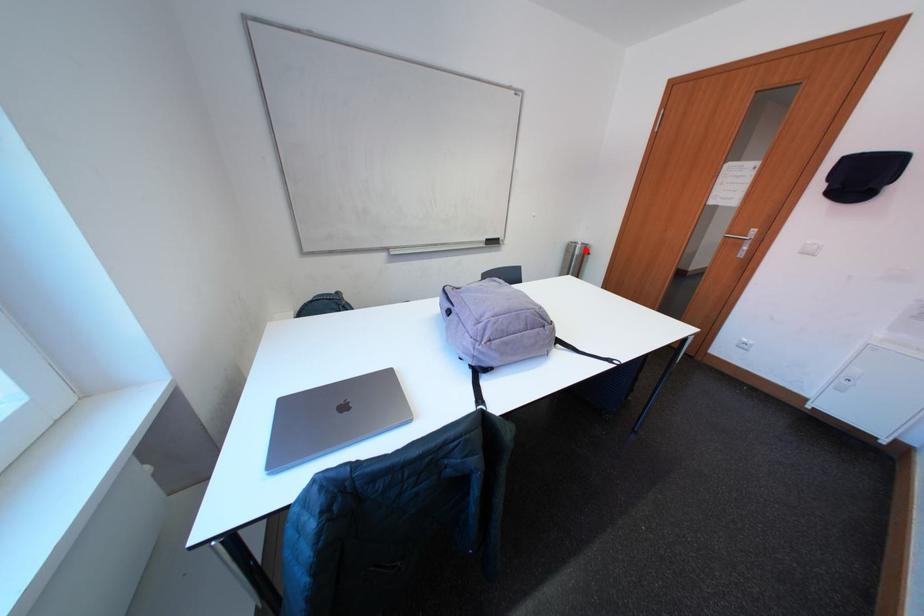
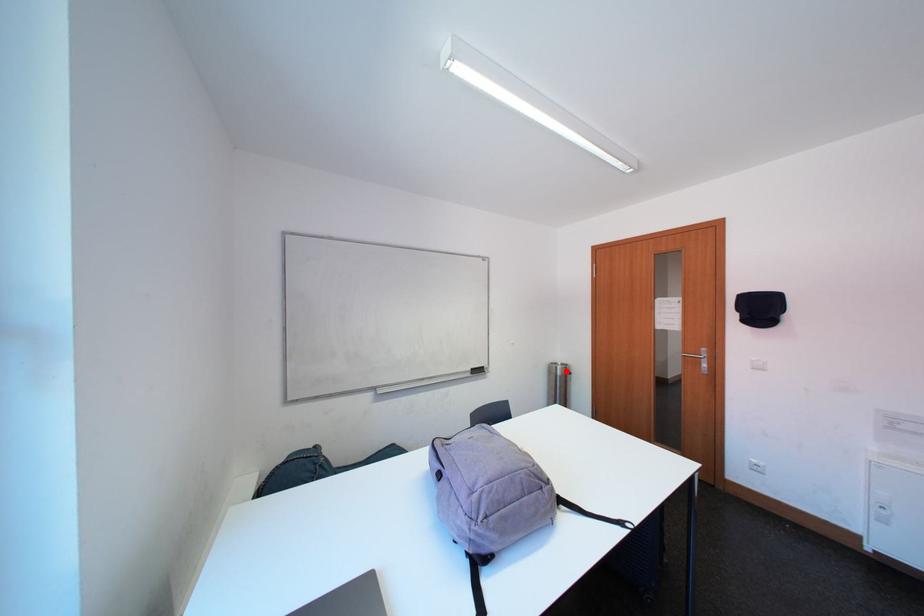
I am providing you with two images of the same scene from different viewpoints. A red point is marked on the first image and another point is marked on the second image. Are the points marked in image1 and image2 representing the same 3D position?

Yes